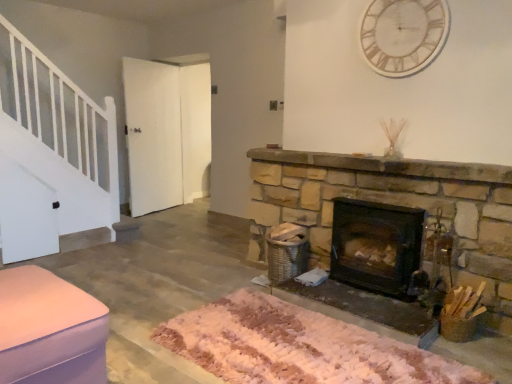
Question: Is white marble clock at upper center wider than dark brown stone wood burning stove at center right?

Choices:
 (A) yes
 (B) no

Answer: (B)

Question: From the image's perspective, is white marble clock at upper center over dark brown stone wood burning stove at center right?

Choices:
 (A) no
 (B) yes

Answer: (B)

Question: Is white marble clock at upper center at the right side of dark brown stone wood burning stove at center right?

Choices:
 (A) yes
 (B) no

Answer: (A)

Question: Is white marble clock at upper center facing away from dark brown stone wood burning stove at center right?

Choices:
 (A) no
 (B) yes

Answer: (A)

Question: From a real-world perspective, is white marble clock at upper center on top of dark brown stone wood burning stove at center right?

Choices:
 (A) no
 (B) yes

Answer: (B)

Question: Is the position of white marble clock at upper center less distant than that of dark brown stone wood burning stove at center right?

Choices:
 (A) no
 (B) yes

Answer: (A)

Question: From the image's perspective, would you say pink fabric ottoman at lower left is shown under white fluffy mat at center?

Choices:
 (A) no
 (B) yes

Answer: (A)

Question: Can you confirm if pink fabric ottoman at lower left is wider than white fluffy mat at center?

Choices:
 (A) yes
 (B) no

Answer: (B)

Question: Is pink fabric ottoman at lower left at the left side of white fluffy mat at center?

Choices:
 (A) yes
 (B) no

Answer: (A)

Question: From a real-world perspective, is pink fabric ottoman at lower left positioned over white fluffy mat at center based on gravity?

Choices:
 (A) yes
 (B) no

Answer: (A)

Question: Would you say pink fabric ottoman at lower left is outside white fluffy mat at center?

Choices:
 (A) yes
 (B) no

Answer: (A)

Question: Could you tell me if pink fabric ottoman at lower left is facing white fluffy mat at center?

Choices:
 (A) no
 (B) yes

Answer: (A)

Question: Does white marble clock at upper center turn towards pink fabric ottoman at lower left?

Choices:
 (A) no
 (B) yes

Answer: (A)